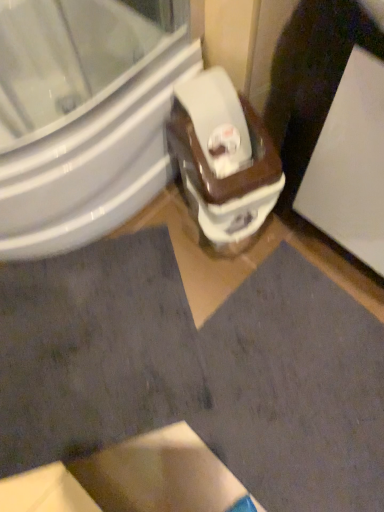
Describe the element at coordinates (350, 165) in the screenshot. I see `white glossy screen door at upper right` at that location.

Image resolution: width=384 pixels, height=512 pixels. Describe the element at coordinates (94, 350) in the screenshot. I see `dark gray fabric at lower left` at that location.

Find the location of a particular element. white glossy bidet at center is located at coordinates (83, 118).

The width and height of the screenshot is (384, 512). I want to click on white glossy toilet at center, so click(x=223, y=160).

Image resolution: width=384 pixels, height=512 pixels. I want to click on white glossy screen door at upper right, so click(350, 165).

Is white glossy toilet at center bigger than dark gray fabric at lower left?

Indeed, white glossy toilet at center has a larger size compared to dark gray fabric at lower left.

Based on the photo, which object is more forward, white glossy toilet at center or dark gray fabric at lower left?

Positioned in front is white glossy toilet at center.

Who is taller, white glossy toilet at center or dark gray fabric at lower left?

Standing taller between the two is white glossy toilet at center.

From the picture: Can you confirm if white glossy toilet at center is positioned to the left of dark gray fabric at lower left?

In fact, white glossy toilet at center is to the right of dark gray fabric at lower left.

Is white glossy screen door at upper right inside or outside of white glossy bidet at center?

The correct answer is: outside.

Considering the relative sizes of white glossy screen door at upper right and white glossy bidet at center in the image provided, is white glossy screen door at upper right shorter than white glossy bidet at center?

No, white glossy screen door at upper right is not shorter than white glossy bidet at center.

The image size is (384, 512). I want to click on screen door positioned vertically above the white glossy bidet at center (from a real-world perspective), so click(x=350, y=165).

Which is behind, point (328, 114) or point (149, 56)?

The point (149, 56) is behind.

From the image's perspective, between white glossy bidet at center and white glossy screen door at upper right, who is located below?

white glossy screen door at upper right appears lower in the image.

Looking at this image, which is less distant, [149,166] or [338,195]?

Point [149,166] is positioned farther from the camera compared to point [338,195].

Considering the positions of objects white glossy bidet at center and white glossy screen door at upper right in the image provided, who is more to the right, white glossy bidet at center or white glossy screen door at upper right?

white glossy screen door at upper right.

Is white glossy bidet at center wider than white glossy screen door at upper right?

Correct, the width of white glossy bidet at center exceeds that of white glossy screen door at upper right.

Between dark gray fabric at lower left and white glossy screen door at upper right, which one has larger size?

white glossy screen door at upper right is bigger.

How much distance is there between dark gray fabric at lower left and white glossy screen door at upper right?

dark gray fabric at lower left and white glossy screen door at upper right are 59.02 centimeters apart.

Is dark gray fabric at lower left facing towards white glossy screen door at upper right?

No.

Is the surface of dark gray fabric at lower left in direct contact with white glossy screen door at upper right?

dark gray fabric at lower left and white glossy screen door at upper right are not in contact.

Is point (79, 386) farther from viewer compared to point (244, 206)?

Yes, it is behind point (244, 206).

From the image's perspective, is dark gray fabric at lower left on white glossy toilet at center?

No, from the image's perspective, dark gray fabric at lower left is not on top of white glossy toilet at center.

In the scene shown: From a real-world perspective, who is located higher, dark gray fabric at lower left or white glossy toilet at center?

In real-world perspective, white glossy toilet at center is above.

In the scene shown: How different are the orientations of dark gray fabric at lower left and white glossy toilet at center in degrees?

78.1 degrees separate the facing orientations of dark gray fabric at lower left and white glossy toilet at center.

Who is shorter, white glossy screen door at upper right or dark gray fabric at lower left?

With less height is dark gray fabric at lower left.

Relative to dark gray fabric at lower left, is white glossy screen door at upper right in front or behind?

Clearly, white glossy screen door at upper right is in front of dark gray fabric at lower left.

From a real-world perspective, is white glossy screen door at upper right physically located above or below dark gray fabric at lower left?

white glossy screen door at upper right is above dark gray fabric at lower left.

The height and width of the screenshot is (512, 384). I want to click on square located on the left of white glossy screen door at upper right, so point(94,350).

From the picture: From a real-world perspective, is dark gray fabric at lower left located higher than white glossy bidet at center?

No, from a real-world perspective, dark gray fabric at lower left is not on top of white glossy bidet at center.

What's the angular difference between dark gray fabric at lower left and white glossy bidet at center's facing directions?

31.3 degrees.

Considering the points (52, 330) and (129, 143), which point is behind, point (52, 330) or point (129, 143)?

The point (52, 330) is farther.

From the picture: From the image's perspective, which object appears higher, dark gray fabric at lower left or white glossy bidet at center?

white glossy bidet at center.

The width and height of the screenshot is (384, 512). Identify the location of toilet above the dark gray fabric at lower left (from the image's perspective). (223, 160).

Find the location of a particular element. This screenshot has height=512, width=384. screen door lying in front of the white glossy bidet at center is located at coordinates (350, 165).

Looking at the image, which one is located closer to white glossy toilet at center, white glossy bidet at center or white glossy screen door at upper right?

white glossy screen door at upper right is closer to white glossy toilet at center.

Which object lies further to the anchor point white glossy screen door at upper right, white glossy bidet at center or white glossy toilet at center?

Based on the image, white glossy bidet at center appears to be further to white glossy screen door at upper right.

Which object lies further to the anchor point white glossy screen door at upper right, dark gray fabric at lower left or white glossy bidet at center?

Based on the image, dark gray fabric at lower left appears to be further to white glossy screen door at upper right.

From the image, which object appears to be nearer to dark gray fabric at lower left, white glossy bidet at center or white glossy screen door at upper right?

white glossy bidet at center lies closer to dark gray fabric at lower left than the other object.

Estimate the real-world distances between objects in this image. Which object is closer to dark gray fabric at lower left, white glossy toilet at center or white glossy screen door at upper right?

white glossy toilet at center is closer to dark gray fabric at lower left.

Considering their positions, is white glossy screen door at upper right positioned further to white glossy toilet at center than white glossy bidet at center?

white glossy bidet at center lies further to white glossy toilet at center than the other object.

Looking at the image, which one is located closer to dark gray fabric at lower left, white glossy screen door at upper right or white glossy bidet at center?

Based on the image, white glossy bidet at center appears to be nearer to dark gray fabric at lower left.

Looking at the image, which one is located closer to white glossy bidet at center, white glossy toilet at center or white glossy screen door at upper right?

white glossy toilet at center.

This screenshot has width=384, height=512. Find the location of `square between white glossy bidet at center and white glossy screen door at upper right from left to right`. square between white glossy bidet at center and white glossy screen door at upper right from left to right is located at coordinates (94, 350).

Where is `toilet between white glossy bidet at center and dark gray fabric at lower left in the vertical direction`? The width and height of the screenshot is (384, 512). toilet between white glossy bidet at center and dark gray fabric at lower left in the vertical direction is located at coordinates (223, 160).

Find the location of `toilet situated between white glossy bidet at center and white glossy screen door at upper right from left to right`. toilet situated between white glossy bidet at center and white glossy screen door at upper right from left to right is located at coordinates (223, 160).

This screenshot has height=512, width=384. What are the coordinates of `toilet between dark gray fabric at lower left and white glossy screen door at upper right from left to right` in the screenshot? It's located at (223, 160).